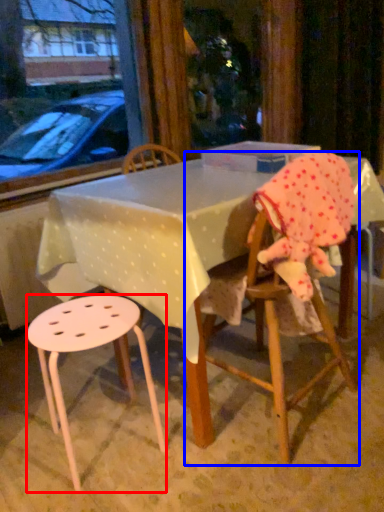
Question: Which object is closer to the camera taking this photo, stool (highlighted by a red box) or chair (highlighted by a blue box)?

Choices:
 (A) stool
 (B) chair

Answer: (B)